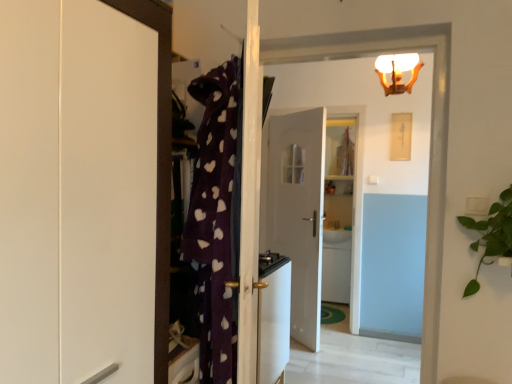
Question: Is there a large distance between white glossy sink at center and white glossy door at upper center, acting as the first door starting from the front?

Choices:
 (A) yes
 (B) no

Answer: (A)

Question: From a real-world perspective, is white glossy sink at center physically above white glossy door at upper center, which ranks as the 2th door in back-to-front order?

Choices:
 (A) yes
 (B) no

Answer: (B)

Question: Would you say white glossy sink at center is outside white glossy door at upper center, acting as the first door starting from the front?

Choices:
 (A) no
 (B) yes

Answer: (B)

Question: From a real-world perspective, is white glossy sink at center located beneath white glossy door at upper center, acting as the first door starting from the front?

Choices:
 (A) yes
 (B) no

Answer: (A)

Question: Is white glossy sink at center wider than white glossy door at upper center, acting as the first door starting from the front?

Choices:
 (A) yes
 (B) no

Answer: (A)

Question: In terms of size, does white frosted glass light fixture at upper center appear bigger or smaller than white glossy door at upper center, which ranks as the 2th door in back-to-front order?

Choices:
 (A) big
 (B) small

Answer: (B)

Question: From their relative heights in the image, would you say white frosted glass light fixture at upper center is taller or shorter than white glossy door at upper center, which ranks as the 2th door in back-to-front order?

Choices:
 (A) short
 (B) tall

Answer: (A)

Question: Is point (390, 87) closer or farther from the camera than point (350, 48)?

Choices:
 (A) farther
 (B) closer

Answer: (A)

Question: From the image's perspective, is white frosted glass light fixture at upper center located above or below white glossy door at upper center, which ranks as the 2th door in back-to-front order?

Choices:
 (A) above
 (B) below

Answer: (A)

Question: Is white glossy door at center, acting as the second door starting from the front, inside or outside of white glossy door at upper center, acting as the first door starting from the front?

Choices:
 (A) inside
 (B) outside

Answer: (B)

Question: From the image's perspective, relative to white glossy door at upper center, acting as the first door starting from the front, is white glossy door at center, acting as the second door starting from the front, above or below?

Choices:
 (A) below
 (B) above

Answer: (A)

Question: In terms of width, does white glossy door at center, acting as the second door starting from the front, look wider or thinner when compared to white glossy door at upper center, acting as the first door starting from the front?

Choices:
 (A) wide
 (B) thin

Answer: (B)

Question: Considering the positions of white glossy door at center, acting as the second door starting from the front, and white glossy door at upper center, acting as the first door starting from the front, in the image, is white glossy door at center, acting as the second door starting from the front, bigger or smaller than white glossy door at upper center, acting as the first door starting from the front,?

Choices:
 (A) small
 (B) big

Answer: (B)

Question: Would you say white glossy door at center, acting as the second door starting from the front, is to the left or to the right of white frosted glass light fixture at upper center in the picture?

Choices:
 (A) left
 (B) right

Answer: (A)

Question: Would you say white glossy door at center, arranged as the 1th door when viewed from the back, is inside or outside white frosted glass light fixture at upper center?

Choices:
 (A) outside
 (B) inside

Answer: (A)